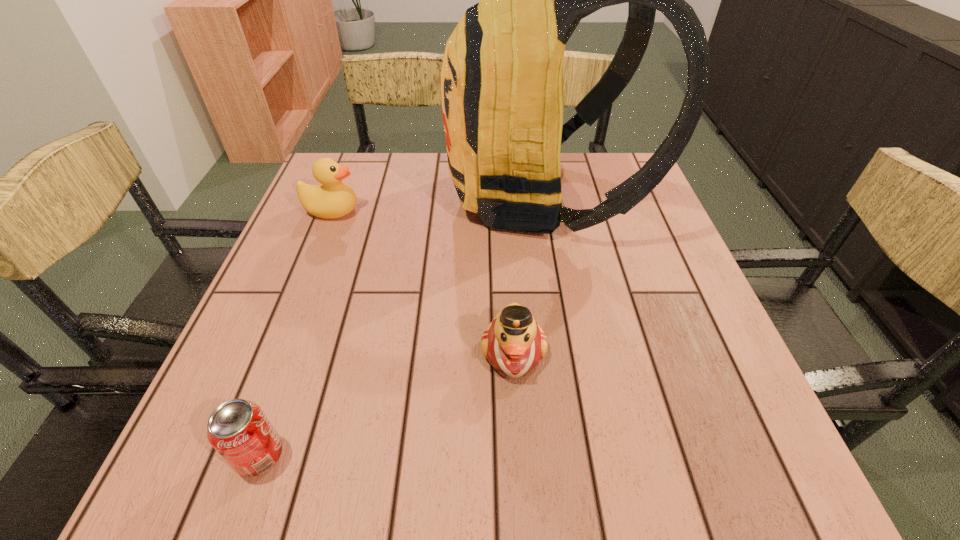
I want to click on vacant region that satisfies the following two spatial constraints: 1. at the beak of the farther duck; 2. on the left side of the soda can, so click(235, 455).

This screenshot has height=540, width=960. I want to click on free space that satisfies the following two spatial constraints: 1. on the front-facing side of the tallest object; 2. on the face of the third farthest object, so click(567, 352).

Find the location of a particular element. The width and height of the screenshot is (960, 540). vacant area that satisfies the following two spatial constraints: 1. at the beak of the nearest object; 2. on the left side of the left duck is located at coordinates (235, 455).

Locate an element on the screen. This screenshot has height=540, width=960. free space that satisfies the following two spatial constraints: 1. on the front-facing side of the backpack; 2. on the front side of the soda can is located at coordinates (586, 455).

Where is `free space that satisfies the following two spatial constraints: 1. on the front-facing side of the tallest object; 2. on the face of the third farthest object`? free space that satisfies the following two spatial constraints: 1. on the front-facing side of the tallest object; 2. on the face of the third farthest object is located at coordinates (567, 352).